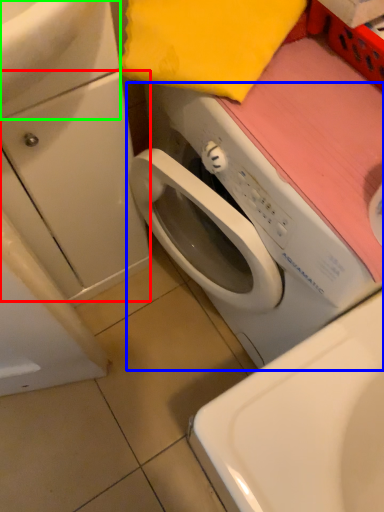
Question: Estimate the real-world distances between objects in this image. Which object is closer to drawer (highlighted by a red box), washing machine (highlighted by a blue box) or sink (highlighted by a green box)?

Choices:
 (A) washing machine
 (B) sink

Answer: (A)